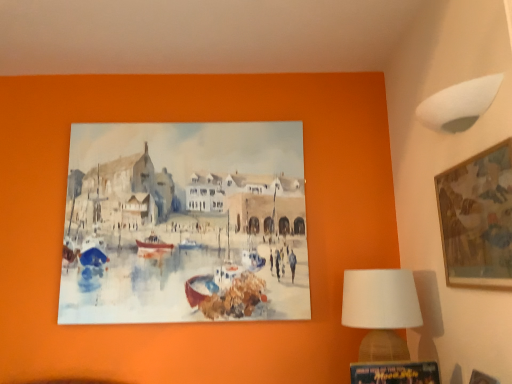
Question: Is white fabric lampshade at lower right situated inside wooden frame at upper right, acting as the 2th picture frame starting from the left, or outside?

Choices:
 (A) inside
 (B) outside

Answer: (B)

Question: From a real-world perspective, is white fabric lampshade at lower right physically located above or below wooden frame at upper right, the first picture frame viewed from the top?

Choices:
 (A) below
 (B) above

Answer: (A)

Question: Based on their relative distances, which object is nearer to the white fabric lampshade at lower right?

Choices:
 (A) wooden picture frame at lower right, marked as the 1th picture frame in a left-to-right arrangement
 (B) wooden frame at upper right, arranged as the 1th picture frame when viewed from the right
 (C) white fabric lampshade at upper right

Answer: (A)

Question: Which of these objects is positioned farthest from the wooden picture frame at lower right, marked as the 1th picture frame in a left-to-right arrangement?

Choices:
 (A) wooden frame at upper right, arranged as the 1th picture frame when viewed from the right
 (B) white fabric lampshade at lower right
 (C) white fabric lampshade at upper right

Answer: (C)